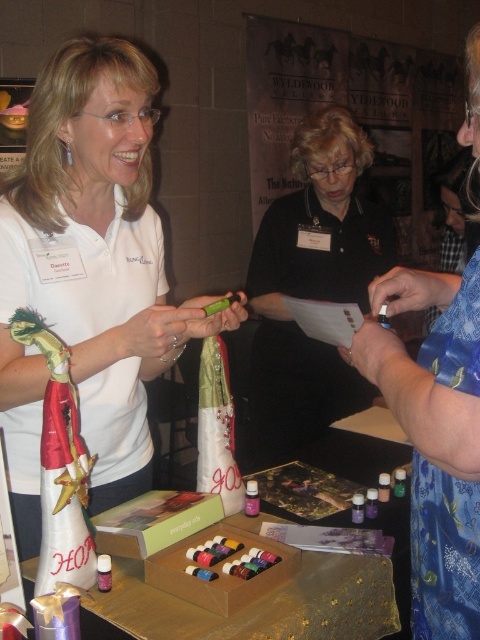
How far apart are black matte pen at center and translucent plastic bottle at center?

The distance of black matte pen at center from translucent plastic bottle at center is 3.59 feet.

Consider the image. Is black matte pen at center smaller than translucent plastic bottle at center?

No.

Find the location of a particular element. The width and height of the screenshot is (480, 640). black matte pen at center is located at coordinates (312, 284).

Between translucent plastic bottle at center and purple glass bottle at center, which one is positioned higher?

Positioned higher is translucent plastic bottle at center.

The image size is (480, 640). What do you see at coordinates (252, 499) in the screenshot? I see `translucent plastic bottle at center` at bounding box center [252, 499].

Where is `translucent plastic bottle at center`? The image size is (480, 640). translucent plastic bottle at center is located at coordinates (252, 499).

Does purple matte bottle at center have a lesser width compared to matte plastic bottle at center?

Yes.

Does purple matte bottle at center appear on the left side of matte plastic bottle at center?

Indeed, purple matte bottle at center is positioned on the left side of matte plastic bottle at center.

In the scene shown: Who is more distant from viewer, (x=101, y=568) or (x=368, y=500)?

Positioned behind is point (x=368, y=500).

In order to click on purple matte bottle at center in this screenshot , I will do `click(104, 572)`.